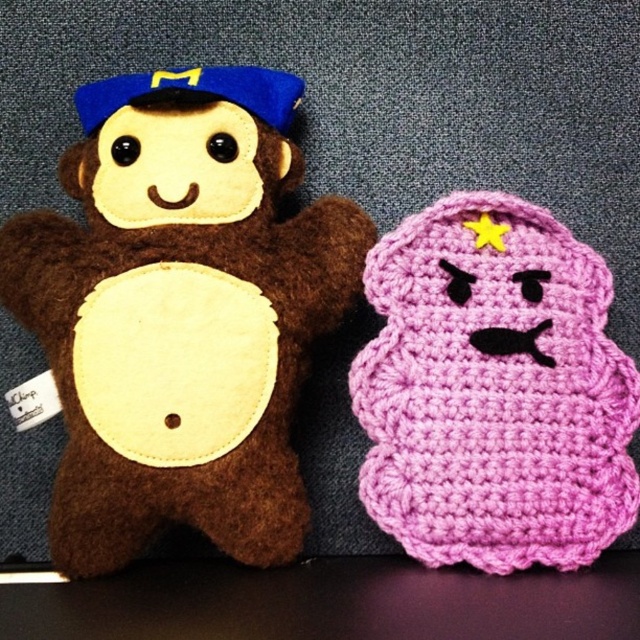
Question: Among these objects, which one is nearest to the camera?

Choices:
 (A) brown felt monkey at left
 (B) crochet pink plush at right

Answer: (A)

Question: Which point is farther from the camera taking this photo?

Choices:
 (A) (381, 376)
 (B) (266, 129)

Answer: (A)

Question: Does brown felt monkey at left have a greater width compared to crochet pink plush at right?

Choices:
 (A) yes
 (B) no

Answer: (A)

Question: Does brown felt monkey at left come behind crochet pink plush at right?

Choices:
 (A) no
 (B) yes

Answer: (A)

Question: Which point is closer to the camera?

Choices:
 (A) crochet pink plush at right
 (B) brown felt monkey at left

Answer: (B)

Question: Does brown felt monkey at left appear over crochet pink plush at right?

Choices:
 (A) no
 (B) yes

Answer: (B)